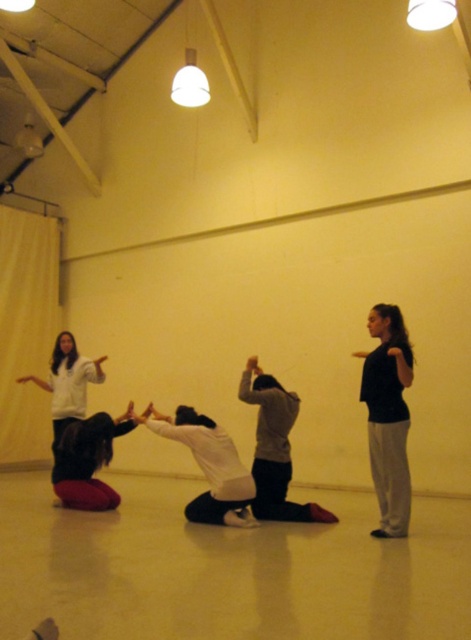
You are a fitness instructor preparing to demonstrate an exercise. You see a white matte squat at center and a dark gray fabric squat at center. Which one is closer to you?

Both the white matte squat at center and dark gray fabric squat at center are at the same distance from you since they are both positioned at the center of the scene.

You are standing in the room and see the black matte shirt at right. If you want to reach it in 2 seconds, what is the minimum speed you need to move at?

The black matte shirt at right is 4.49 meters away. To reach it in 2 seconds, you need to move at a minimum speed of 2.245 meters per second.

You are standing in the dance class room and see two points marked on the floor at coordinates point (151,429) and point (89,458). Which point is closer to you?

Point (151,429) is closer to the viewer than point (89,458).